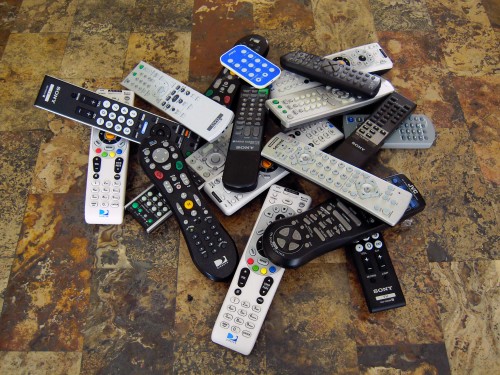
Locate an element on the screen. Image resolution: width=500 pixels, height=375 pixels. empty space below remotes is located at coordinates [246, 366].